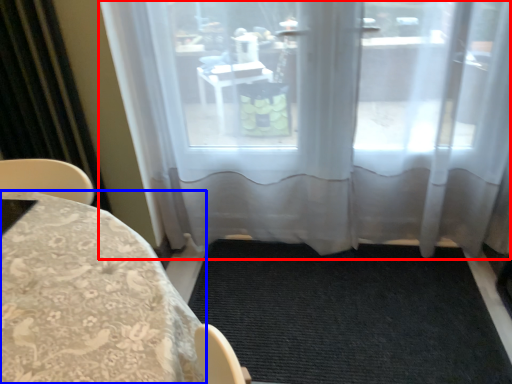
Question: Which point is further to the camera, window (highlighted by a red box) or furniture (highlighted by a blue box)?

Choices:
 (A) window
 (B) furniture

Answer: (A)